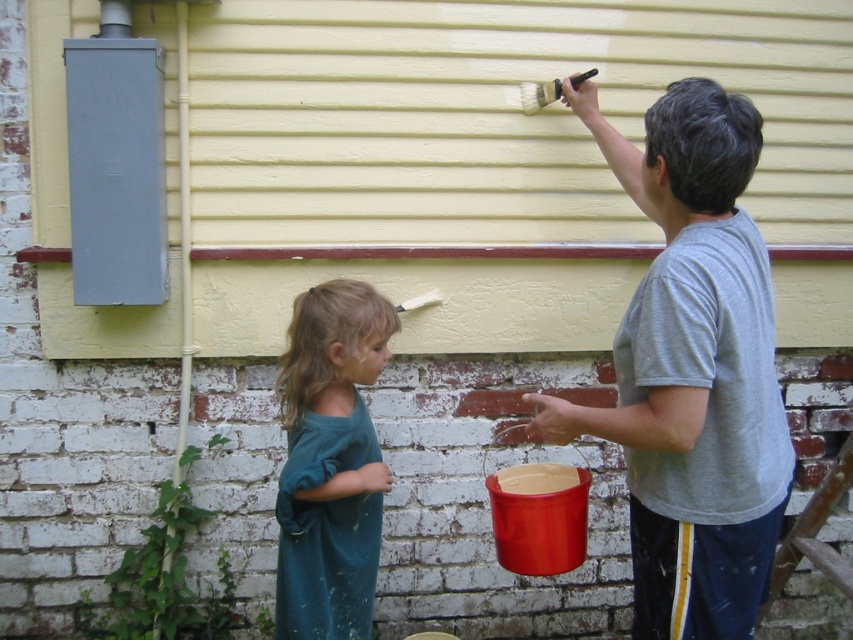
You are standing in front of the wall being painted. Which person is taller, the one wearing the matte gray shirt at upper right or the one wearing the teal fabric shirt at lower left?

The matte gray shirt at upper right is taller than the teal fabric shirt at lower left according to the description.